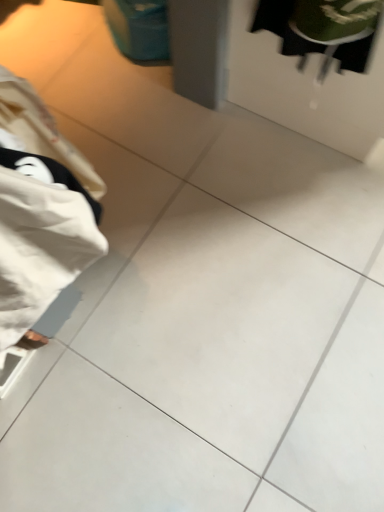
In order to face white fabric at left, should I rotate leftwards or rightwards?

Rotate your view left by about 25.481°.

Locate an element on the screen. The height and width of the screenshot is (512, 384). white fabric at left is located at coordinates (39, 247).

What do you see at coordinates (39, 247) in the screenshot?
I see `white fabric at left` at bounding box center [39, 247].

The image size is (384, 512). Find the location of `white fabric at left`. white fabric at left is located at coordinates (39, 247).